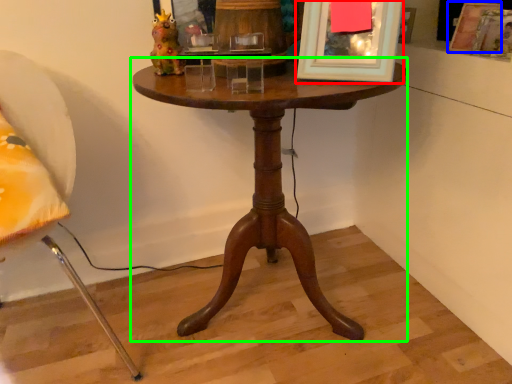
Question: Based on their relative distances, which object is nearer to picture frame (highlighted by a red box)? Choose from picture frame (highlighted by a blue box) and table (highlighted by a green box).

Choices:
 (A) picture frame
 (B) table

Answer: (B)